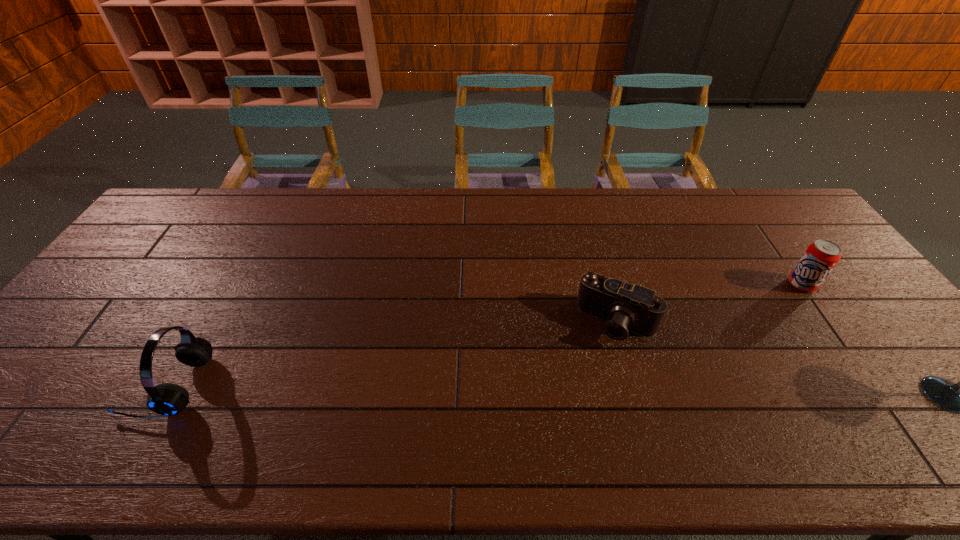
At what (x,y) coordinates should I click in order to perform the action: click on free space located 0.120m on the front-facing side of the camera. Please return your answer as a coordinate pair (x, y). The width and height of the screenshot is (960, 540). Looking at the image, I should click on (588, 380).

Locate an element on the screen. The height and width of the screenshot is (540, 960). free space located on the front-facing side of the camera is located at coordinates (581, 393).

In order to click on vacant space located 0.240m on the surface of the second shortest object in this screenshot , I will do `click(743, 325)`.

I want to click on vacant position located 0.280m on the surface of the second shortest object, so click(x=734, y=331).

Where is `vacant space located on the surface of the second shortest object`? vacant space located on the surface of the second shortest object is located at coordinates (755, 317).

I want to click on object that is positioned at the near edge, so click(x=167, y=399).

Where is `object at the right edge`? The image size is (960, 540). object at the right edge is located at coordinates (820, 257).

The image size is (960, 540). Find the location of `free region at the far edge`. free region at the far edge is located at coordinates (361, 199).

Where is `free space at the near edge of the desktop`? free space at the near edge of the desktop is located at coordinates (880, 410).

Locate an element on the screen. Image resolution: width=960 pixels, height=540 pixels. vacant space at the left edge of the desktop is located at coordinates (108, 282).